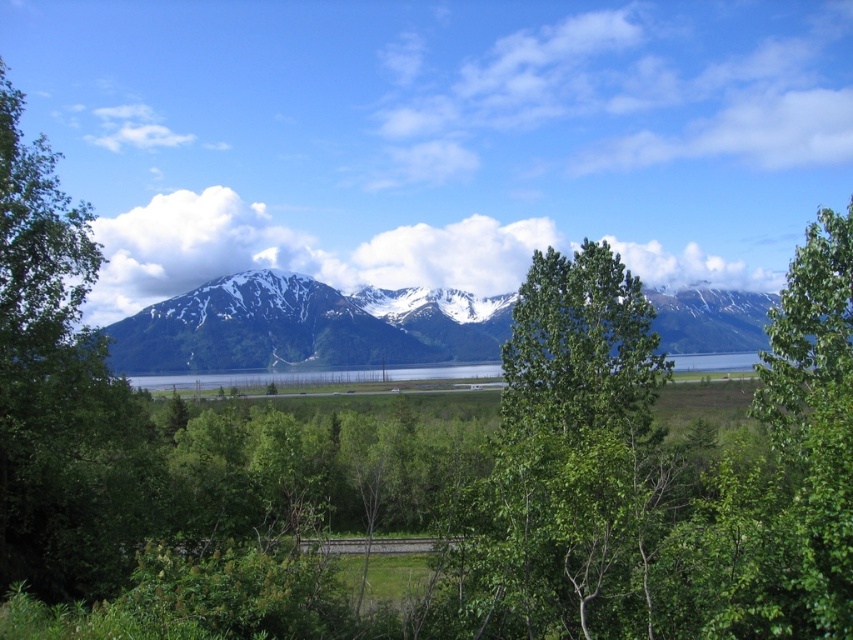
Question: Observing the image, what is the correct spatial positioning of snowy rocky mountain range at center in reference to green leafy tree at upper right?

Choices:
 (A) left
 (B) right

Answer: (A)

Question: Which of these objects is positioned farthest from the green leafy tree at upper right?

Choices:
 (A) snowy rocky mountain range at center
 (B) green leafy tree at center
 (C) green leafy tree at left

Answer: (A)

Question: Which object is positioned farthest from the green leafy tree at center?

Choices:
 (A) green leafy tree at left
 (B) clear water at center
 (C) green leafy tree at upper right
 (D) snowy rocky mountain range at center

Answer: (D)

Question: Among these objects, which one is nearest to the camera?

Choices:
 (A) green leafy tree at upper right
 (B) clear water at center
 (C) green leafy tree at left

Answer: (A)

Question: Does snowy rocky mountain range at center have a smaller size compared to clear water at center?

Choices:
 (A) yes
 (B) no

Answer: (B)

Question: Does green leafy tree at center lie behind green leafy tree at upper right?

Choices:
 (A) yes
 (B) no

Answer: (A)